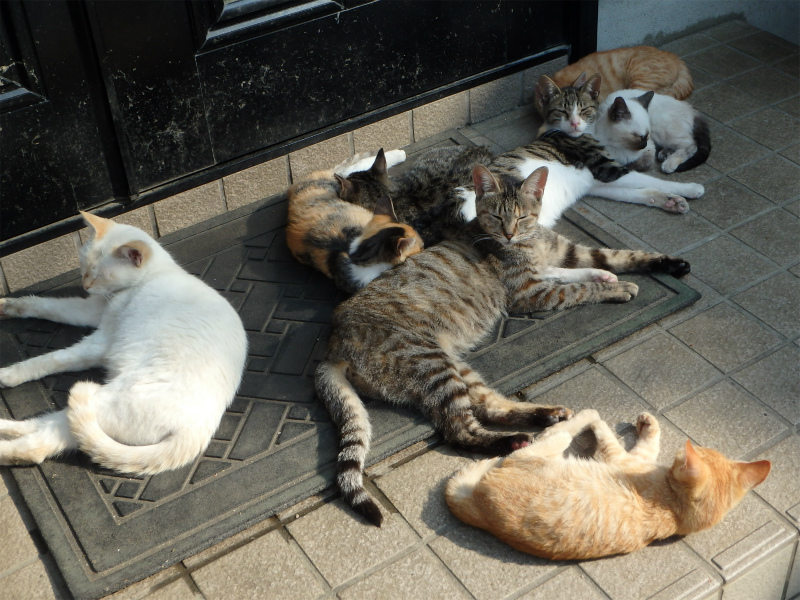
Where is `left front leg`? left front leg is located at coordinates (30, 366).